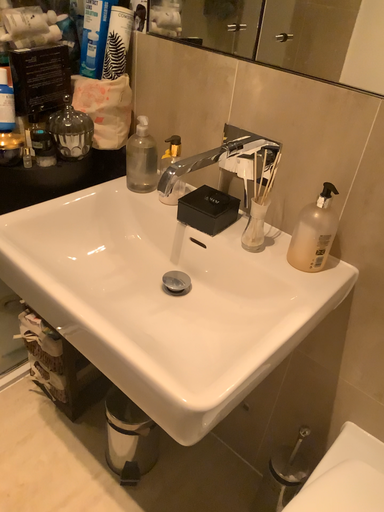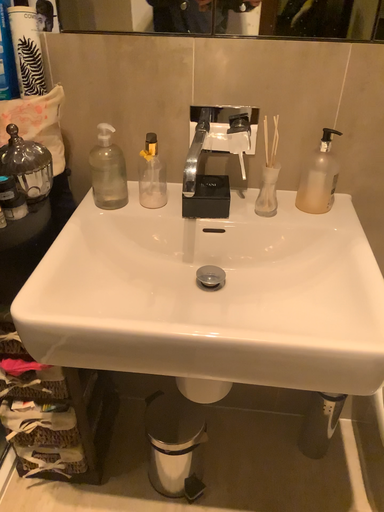
Question: How did the camera likely rotate when shooting the video?

Choices:
 (A) rotated right
 (B) rotated left

Answer: (A)